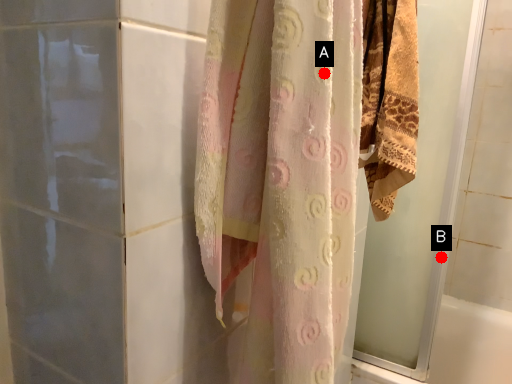
Question: Two points are circled on the image, labeled by A and B beside each circle. Among these points, which one is nearest to the camera?

Choices:
 (A) A is closer
 (B) B is closer

Answer: (A)